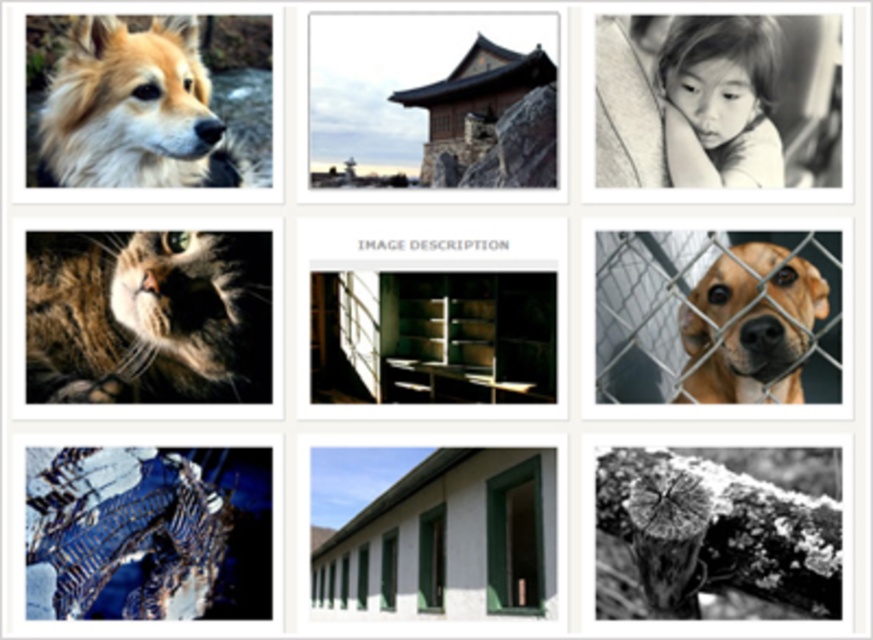
Who is positioned more to the right, tabby fur cat at upper left or fuzzy brown fur at upper left?

Positioned to the right is tabby fur cat at upper left.

Which is behind, point (227, 376) or point (157, 113)?

Point (227, 376)

You are a GUI agent. You are given a task and a screenshot of the screen. Output one action in this format:
    pyautogui.click(x=<x>, y=<y>)
    Task: Click on the tabby fur cat at upper left
    The width and height of the screenshot is (873, 640).
    Given the screenshot: What is the action you would take?
    pyautogui.click(x=148, y=316)

Is point (665, 115) behind point (796, 337)?

Yes, point (665, 115) is farther from viewer.

Does smooth skin child at upper right appear over brown furry dog at center right?

Correct, smooth skin child at upper right is located above brown furry dog at center right.

Where is `smooth skin child at upper right`? smooth skin child at upper right is located at coordinates (720, 100).

Find the location of a particular element. Image resolution: width=873 pixels, height=640 pixels. smooth skin child at upper right is located at coordinates click(x=720, y=100).

Who is more forward, (149, 362) or (464, 296)?

Point (149, 362)

Measure the distance between tabby fur cat at upper left and camera.

The distance of tabby fur cat at upper left from camera is 1.91 meters.

The image size is (873, 640). Identify the location of tabby fur cat at upper left. (148, 316).